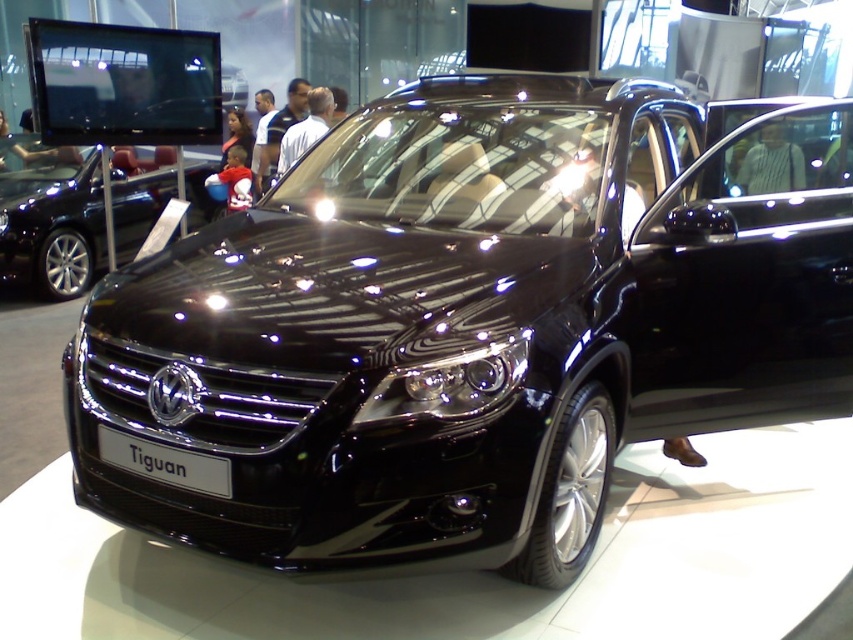
You are a photographer at the auto show and want to capture a photo of the glossy black car at center and the white plastic sign at center. Since the car is much taller than the sign, how should you position your camera to ensure both are fully visible in the frame?

To capture both the glossy black car at center and the white plastic sign at center in the frame, position the camera lower to include the full height of the car while still capturing the sign, which is shorter. This way, both objects will be visible without cropping any part of them.

You are standing in the auto show and want to take a photo of the glossy black car at center and the glossy chrome headlight at center. The camera you have can focus on objects up to 15 feet away. Will both objects be in focus?

The glossy black car at center is 18.13 feet away from the glossy chrome headlight at center. Since the camera can only focus up to 15 feet, both objects are beyond the camera range and cannot be in focus.